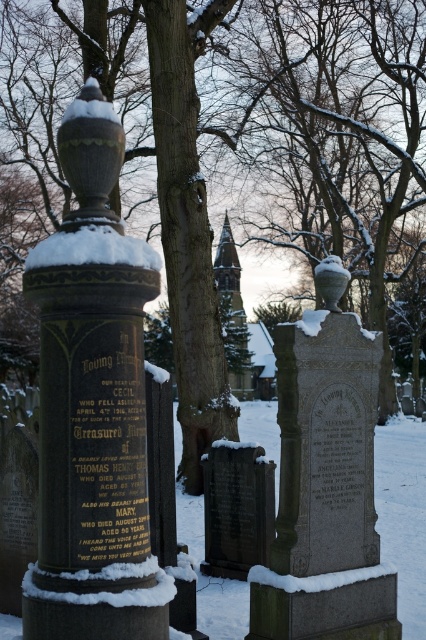
You are a photographer trying to capture the dark gray stone gravestone at center and the white fluffy snow at top in a single shot. Given that your camera can only focus on objects within a 1.5 meter height range, will both objects fit within this range?

The dark gray stone gravestone at center is bigger than the white fluffy snow at top. Since the gravestone is taller, it likely exceeds the 1.5 meter height range, making it impossible for both to fit within the camera focus range.

You are standing at the entrance of the cemetery and want to find the dark gray stone gravestone at center. According to the coordinates provided, in which direction should you walk from your current position to reach it?

The dark gray stone gravestone at center is located at point (236, 508). Since coordinates typically use x and y axes where higher x values move right and higher y values move forward, you should walk forward and slightly to the right from your current position at the entrance to reach it.

Based on the scene description, where is the bronze plaque at center located in terms of its 2D coordinates?

The bronze plaque at center is located at the 2D coordinates point (92, 404).